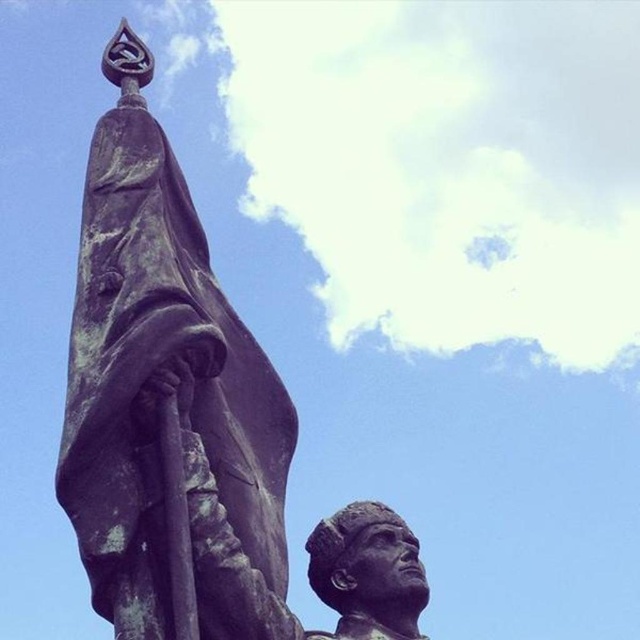
Question: Observing the image, what is the correct spatial positioning of bronze statue at left in reference to bronze statue head at center?

Choices:
 (A) left
 (B) right

Answer: (A)

Question: Where is bronze statue at left located in relation to bronze statue head at center in the image?

Choices:
 (A) left
 (B) right

Answer: (A)

Question: Does bronze statue at left have a greater width compared to bronze statue head at center?

Choices:
 (A) yes
 (B) no

Answer: (A)